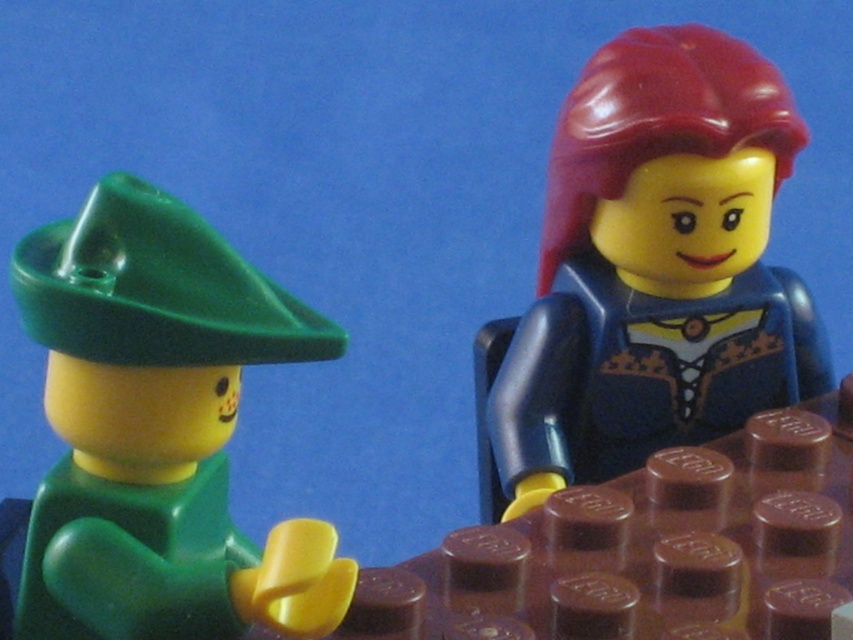
Can you confirm if shiny red hair at upper right is wider than green matte hat at left?

Indeed, shiny red hair at upper right has a greater width compared to green matte hat at left.

From the picture: Does shiny red hair at upper right appear over green matte hat at left?

Yes.

This screenshot has width=853, height=640. What do you see at coordinates (650, 273) in the screenshot?
I see `shiny red hair at upper right` at bounding box center [650, 273].

Where is `shiny red hair at upper right`? shiny red hair at upper right is located at coordinates (650, 273).